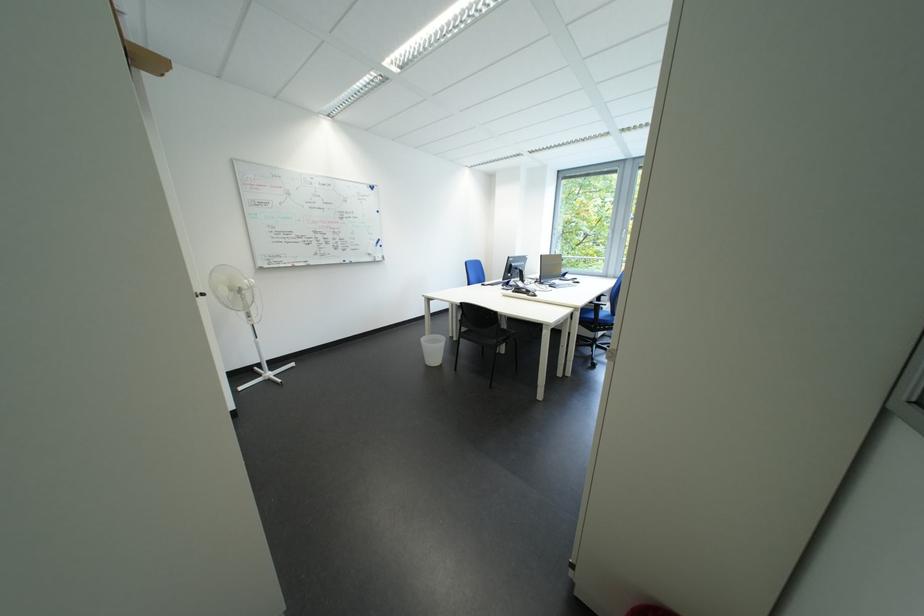
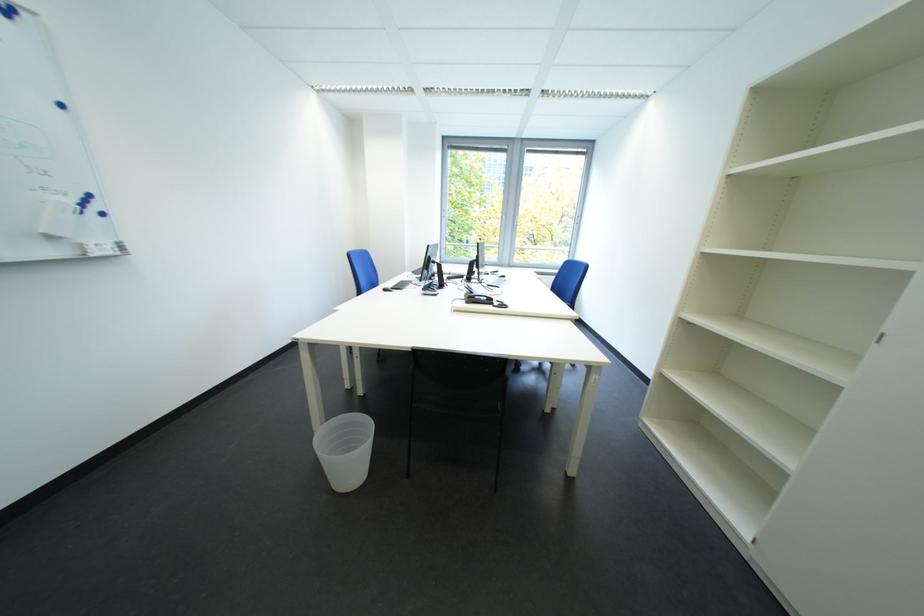
The point at [446,352] is marked in the first image. Where is the corresponding point in the second image?

(362, 455)